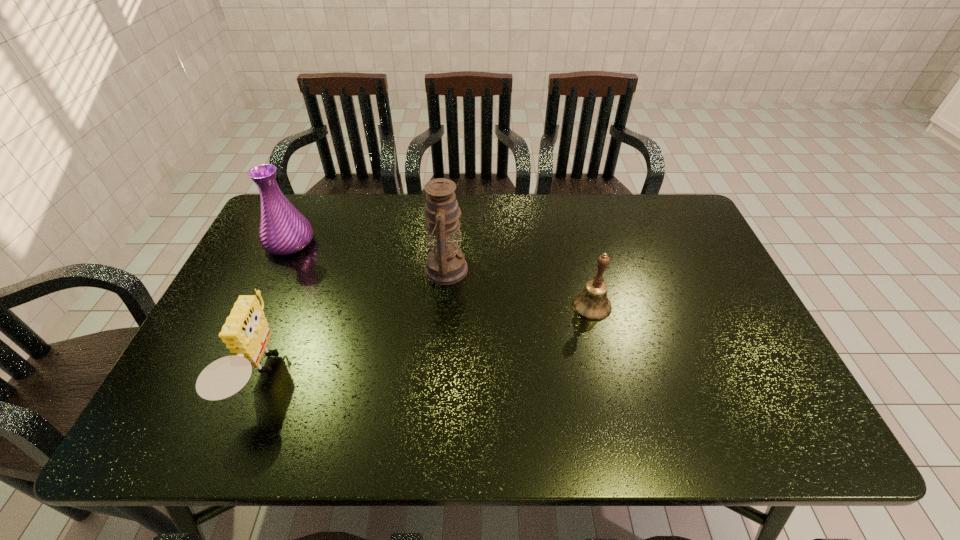
The width and height of the screenshot is (960, 540). I want to click on vacant space that's between the third shortest object and the third object from left to right, so click(367, 256).

Locate an element on the screen. Image resolution: width=960 pixels, height=540 pixels. free spot between the oil lamp and the nearest object is located at coordinates (351, 322).

At what (x,y) coordinates should I click in order to perform the action: click on free point between the sponge and the second object from right to left. Please return your answer as a coordinate pair (x, y). The height and width of the screenshot is (540, 960). Looking at the image, I should click on (351, 322).

The width and height of the screenshot is (960, 540). I want to click on free space between the second object from right to left and the nearest object, so click(351, 322).

In order to click on free space between the sponge and the bell in this screenshot , I will do `click(425, 340)`.

I want to click on blank region between the second object from right to left and the nearest object, so click(x=351, y=322).

The height and width of the screenshot is (540, 960). What are the coordinates of `free area in between the bell and the nearest object` in the screenshot? It's located at (425, 340).

Locate an element on the screen. The image size is (960, 540). empty space between the third object from left to right and the bell is located at coordinates (517, 287).

Image resolution: width=960 pixels, height=540 pixels. Identify the location of the third closest object to the second object from right to left. (283, 230).

Find the location of a particular element. the third closest object to the rightmost object is located at coordinates (283, 230).